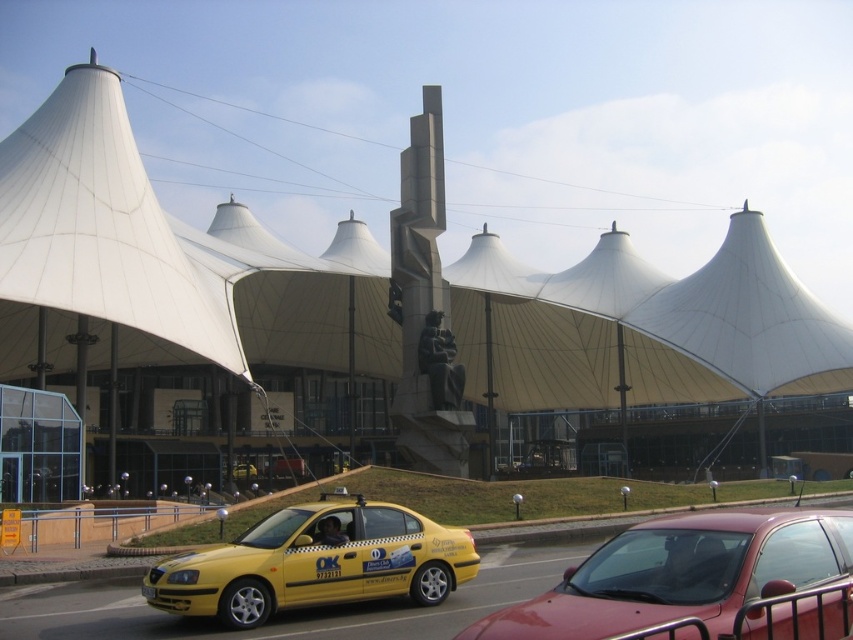
Does white fabric canopy at upper left appear on the left side of yellow matte taxi at lower left?

Yes, white fabric canopy at upper left is to the left of yellow matte taxi at lower left.

Which of these two, white fabric canopy at upper left or yellow matte taxi at lower left, stands shorter?

With less height is yellow matte taxi at lower left.

Is point (80, 307) more distant than point (352, 550)?

Yes, it is.

Find the location of a particular element. The height and width of the screenshot is (640, 853). white fabric canopy at upper left is located at coordinates (99, 244).

Which is below, white fabric canopy at upper left or yellow plastic license plate at center?

yellow plastic license plate at center is lower down.

Does point (96, 163) come in front of point (337, 572)?

That is False.

At what (x,y) coordinates should I click in order to perform the action: click on white fabric canopy at upper left. Please return your answer as a coordinate pair (x, y). Image resolution: width=853 pixels, height=640 pixels. Looking at the image, I should click on (99, 244).

Based on the photo, can you confirm if white fabric canopy at upper left is positioned to the left of matte red sedan at center?

Indeed, white fabric canopy at upper left is positioned on the left side of matte red sedan at center.

What are the coordinates of `white fabric canopy at upper left` in the screenshot? It's located at [x=99, y=244].

Image resolution: width=853 pixels, height=640 pixels. Find the location of `white fabric canopy at upper left`. white fabric canopy at upper left is located at coordinates (99, 244).